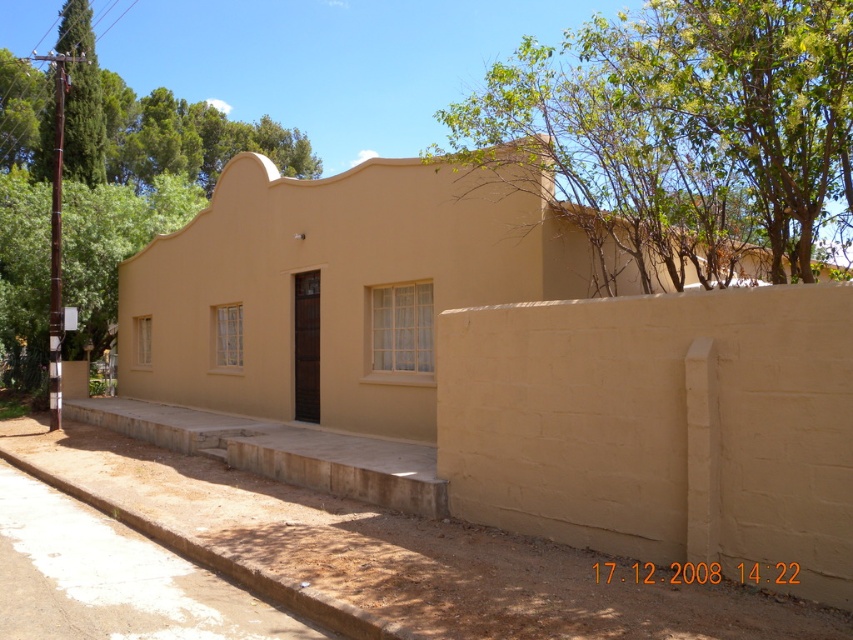
Question: Does green leafy tree at upper right have a greater width compared to brown concrete curb at lower left?

Choices:
 (A) yes
 (B) no

Answer: (A)

Question: Does green leafy tree at upper right have a larger size compared to green textured tree at upper left?

Choices:
 (A) yes
 (B) no

Answer: (A)

Question: Among these points, which one is farthest from the camera?

Choices:
 (A) (564, 307)
 (B) (303, 593)
 (C) (88, 36)
 (D) (270, 150)

Answer: (D)

Question: Considering the real-world distances, which object is closest to the green textured tree at upper left?

Choices:
 (A) matte yellow wall at center
 (B) green leafy tree at upper left
 (C) brown concrete curb at lower left

Answer: (B)

Question: Is green leafy tree at upper right to the left of green textured tree at upper left from the viewer's perspective?

Choices:
 (A) yes
 (B) no

Answer: (B)

Question: Which of the following is the farthest from the observer?

Choices:
 (A) matte yellow wall at center
 (B) brown concrete curb at lower left
 (C) green leafy tree at upper right

Answer: (C)